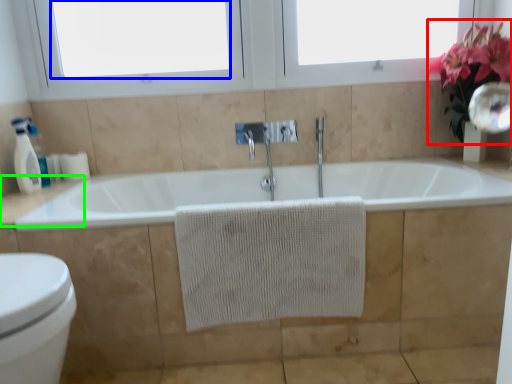
Question: Based on their relative distances, which object is nearer to floral arrangement (highlighted by a red box)? Choose from window screen (highlighted by a blue box) and counter top (highlighted by a green box).

Choices:
 (A) window screen
 (B) counter top

Answer: (A)